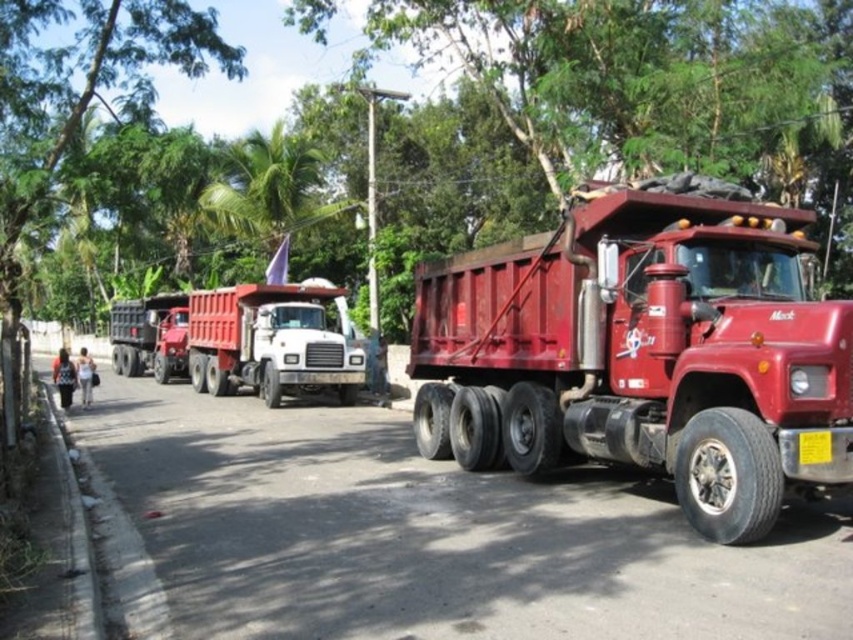
Is matte red dump truck at center positioned in front of green leafy tree at upper center?

Yes.

Is matte red dump truck at center wider than green leafy tree at upper center?

Yes, matte red dump truck at center is wider than green leafy tree at upper center.

This screenshot has width=853, height=640. I want to click on matte red dump truck at center, so click(x=270, y=340).

Who is positioned more to the left, shiny red trailer truck at center or green leafy tree at upper center?

From the viewer's perspective, green leafy tree at upper center appears more on the left side.

Who is more forward, (780, 301) or (293, 195)?

Point (780, 301)

Locate an element on the screen. This screenshot has height=640, width=853. shiny red trailer truck at center is located at coordinates (643, 352).

Where is `matte red dump truck at center`? matte red dump truck at center is located at coordinates (270, 340).